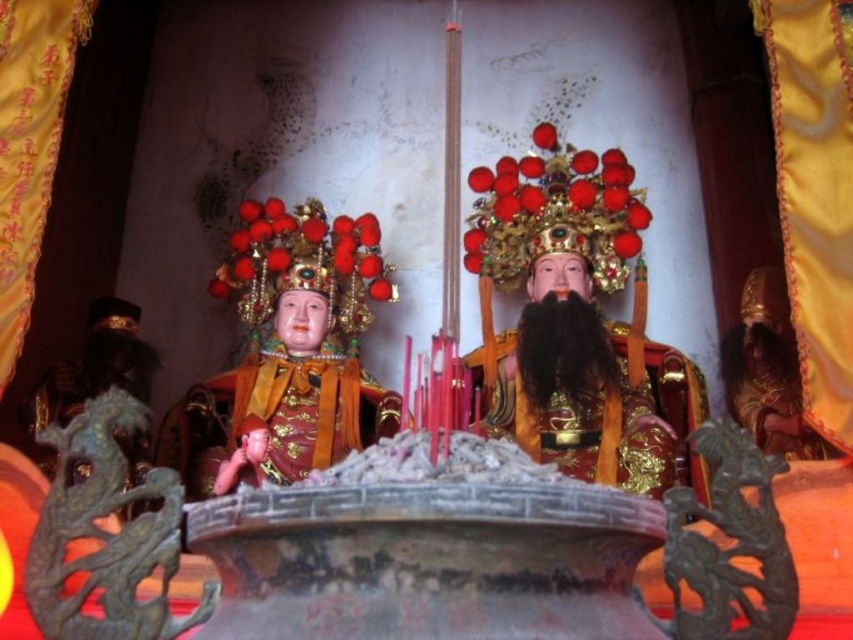
Between point (755, 337) and point (235, 467), which one is positioned in front?

Point (235, 467) is more forward.

Is gold textured statue at right shorter than smooth skin baby at lower left?

No.

Does point (782, 292) lie in front of point (259, 442)?

Yes, point (782, 292) is closer to viewer.

This screenshot has height=640, width=853. Find the location of `gold textured statue at right`. gold textured statue at right is located at coordinates (767, 371).

Who is positioned more to the left, matte gold statue at center or gold textured statue at right?

matte gold statue at center is more to the left.

Between matte gold statue at center and gold textured statue at right, which one is positioned lower?

Positioned lower is matte gold statue at center.

Find the location of a particular element. matte gold statue at center is located at coordinates (289, 353).

Is glossy gold statue at center below gold textured statue at right?

No, glossy gold statue at center is not below gold textured statue at right.

Is point (572, 387) farther from viewer compared to point (746, 372)?

Yes, point (572, 387) is farther from viewer.

Identify the location of glossy gold statue at center. pyautogui.click(x=567, y=314).